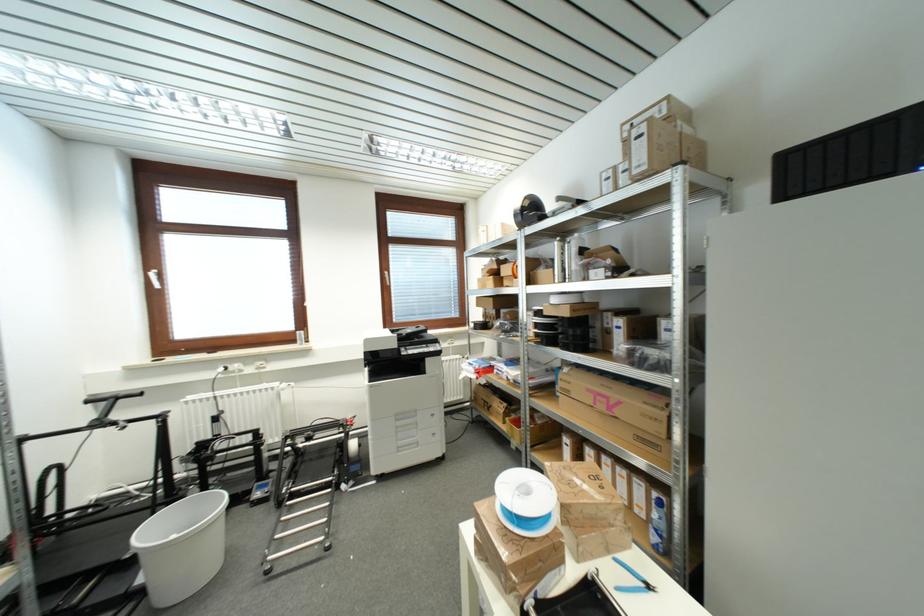
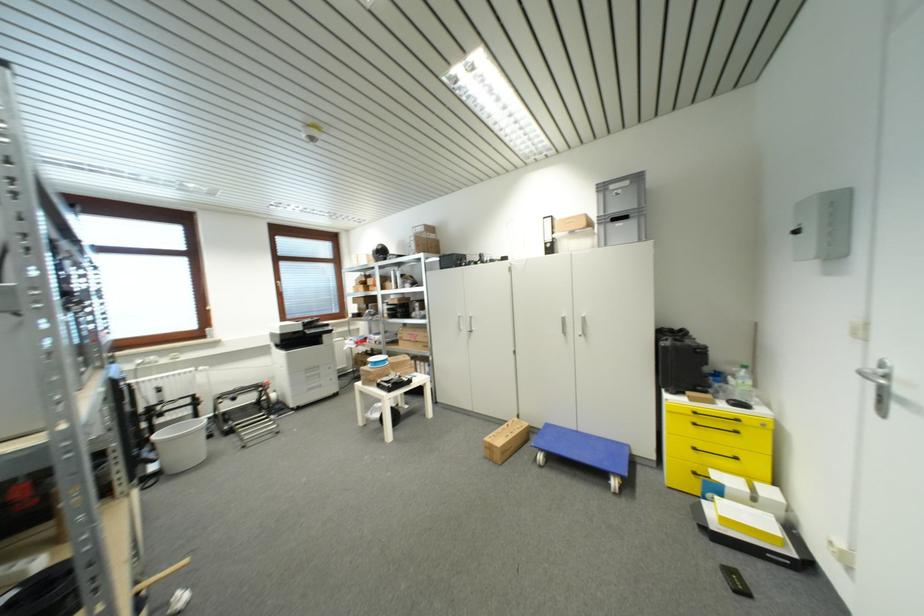
The point at (427, 331) is marked in the first image. Where is the corresponding point in the second image?

(320, 321)